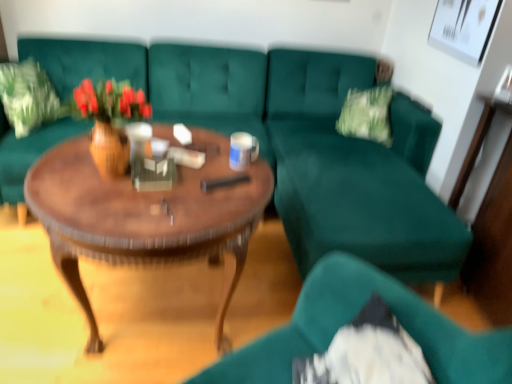
Locate an element on the screen. The height and width of the screenshot is (384, 512). free space in front of wooden vase with flowers at center is located at coordinates (100, 207).